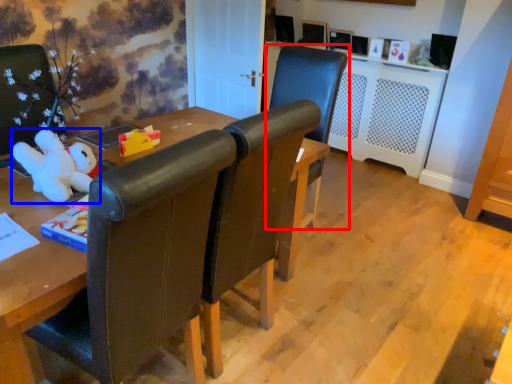
Question: Which point is further to the camera, chair (highlighted by a red box) or toy (highlighted by a blue box)?

Choices:
 (A) chair
 (B) toy

Answer: (A)